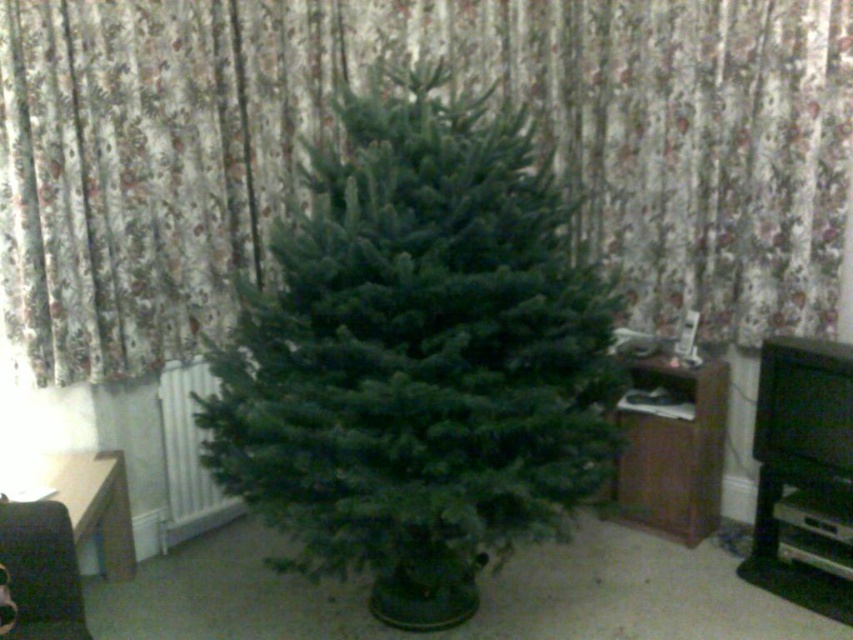
Between floral fabric curtain at center and green matte christmas tree at center, which one has less height?

floral fabric curtain at center

Between point (354, 67) and point (546, 432), which one is positioned behind?

Positioned behind is point (354, 67).

Identify the location of floral fabric curtain at center. This screenshot has width=853, height=640. (357, 81).